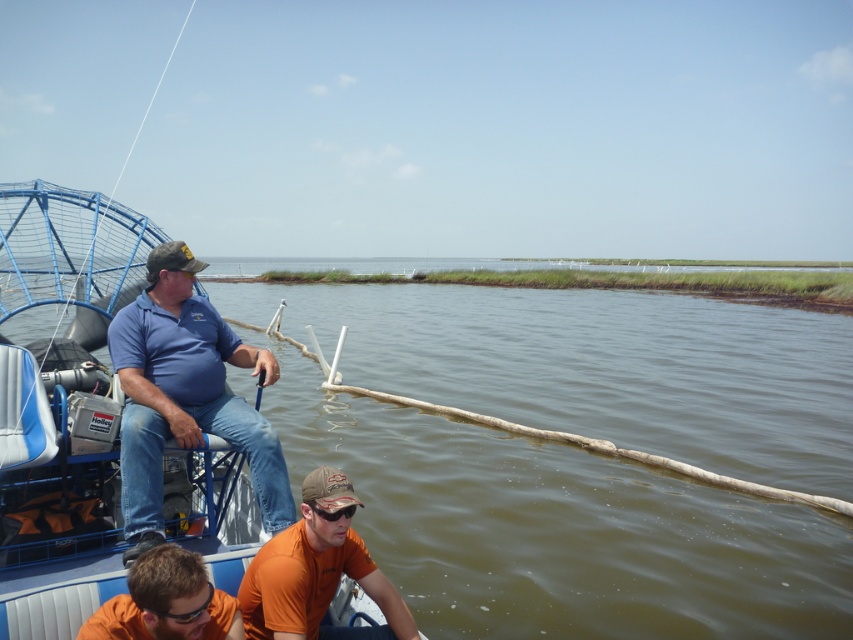
Who is positioned more to the right, brown murky water at center or orange matte shirt at lower center?

brown murky water at center is more to the right.

Which is behind, point (482, 596) or point (207, 602)?

Point (482, 596)

Image resolution: width=853 pixels, height=640 pixels. Identify the location of brown murky water at center. (560, 529).

Which is more to the right, brown murky water at center or orange cotton shirt at lower center?

Positioned to the right is brown murky water at center.

Is point (808, 449) positioned before point (308, 582)?

That is False.

The image size is (853, 640). Identify the location of brown murky water at center. (560, 529).

You are a GUI agent. You are given a task and a screenshot of the screen. Output one action in this format:
    pyautogui.click(x=<x>, y=<y>)
    Task: Click on the brown murky water at center
    This screenshot has width=853, height=640.
    Given the screenshot: What is the action you would take?
    pyautogui.click(x=560, y=529)

Consider the image. Who is more forward, (x=224, y=385) or (x=305, y=595)?

Point (x=305, y=595) is more forward.

Is blue denim jeans at left shorter than orange cotton shirt at lower center?

In fact, blue denim jeans at left may be taller than orange cotton shirt at lower center.

Is point (273, 472) farther from viewer compared to point (305, 621)?

Yes, it is.

In order to click on blue denim jeans at left in this screenshot , I will do `click(184, 394)`.